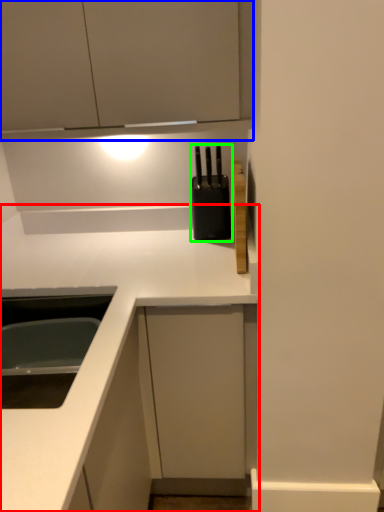
Question: Considering the real-world distances, which object is closest to countertop (highlighted by a red box)? cabinetry (highlighted by a blue box) or appliance (highlighted by a green box).

Choices:
 (A) cabinetry
 (B) appliance

Answer: (B)